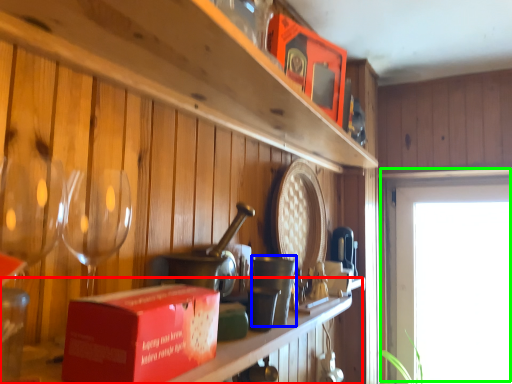
Question: Estimate the real-world distances between objects in this image. Which object is closer to table (highlighted by a red box), tableware (highlighted by a blue box) or window (highlighted by a green box)?

Choices:
 (A) tableware
 (B) window

Answer: (A)